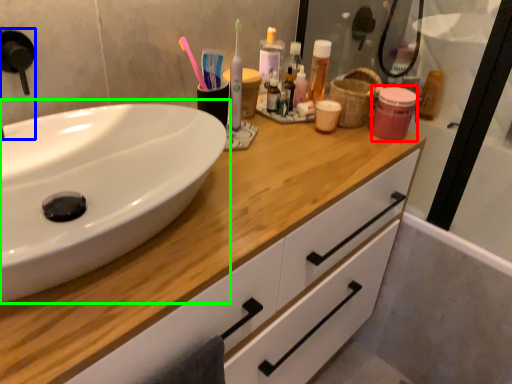
Question: Considering the real-world distances, which object is closest to mouthwash (highlighted by a red box)? faucet (highlighted by a blue box) or sink (highlighted by a green box).

Choices:
 (A) faucet
 (B) sink

Answer: (B)